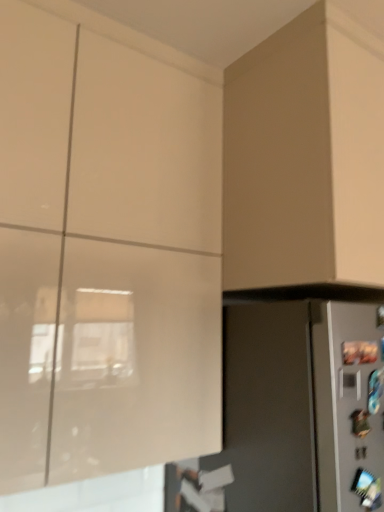
You are a GUI agent. You are given a task and a screenshot of the screen. Output one action in this format:
    pyautogui.click(x=<x>, y=<y>)
    Task: Click on the matte white cabinet at upper left, which is counted as the 2th cabinetry, starting from the right
    This screenshot has height=512, width=384.
    Given the screenshot: What is the action you would take?
    pyautogui.click(x=105, y=248)

Find the location of `matte gray refrigerator at lower right`. matte gray refrigerator at lower right is located at coordinates (296, 410).

You are a GUI agent. You are given a task and a screenshot of the screen. Output one action in this format:
    pyautogui.click(x=<x>, y=<y>)
    Task: Click on the matte beige cabinet at upper right, arranged as the second cabinetry when viewed from the left
    This screenshot has height=512, width=384.
    Given the screenshot: What is the action you would take?
    pyautogui.click(x=305, y=156)

The width and height of the screenshot is (384, 512). Identify the location of matte white cabinet at upper left, which is counted as the 2th cabinetry, starting from the right. (105, 248).

Is matte white cabinet at upper left, which is counted as the 2th cabinetry, starting from the right, closer to camera compared to matte beige cabinet at upper right, arranged as the second cabinetry when viewed from the left?

Yes, it is.

The image size is (384, 512). Identify the location of cabinetry that appears on the left of matte beige cabinet at upper right, acting as the 1th cabinetry starting from the right. (105, 248).

Would you say matte white cabinet at upper left, arranged as the 1th cabinetry when viewed from the left, is inside or outside matte beige cabinet at upper right, arranged as the second cabinetry when viewed from the left?

matte white cabinet at upper left, arranged as the 1th cabinetry when viewed from the left, lies outside matte beige cabinet at upper right, arranged as the second cabinetry when viewed from the left.

Is there a large distance between matte white cabinet at upper left, which is counted as the 2th cabinetry, starting from the right, and matte beige cabinet at upper right, acting as the 1th cabinetry starting from the right?

No, matte white cabinet at upper left, which is counted as the 2th cabinetry, starting from the right, is not far from matte beige cabinet at upper right, acting as the 1th cabinetry starting from the right.

Measure the distance between matte gray refrigerator at lower right and matte beige cabinet at upper right, acting as the 1th cabinetry starting from the right.

matte gray refrigerator at lower right is 13.05 inches from matte beige cabinet at upper right, acting as the 1th cabinetry starting from the right.

Considering the points (362, 499) and (327, 267), which point is behind, point (362, 499) or point (327, 267)?

Positioned behind is point (327, 267).

Would you consider matte gray refrigerator at lower right to be distant from matte beige cabinet at upper right, arranged as the second cabinetry when viewed from the left?

No, there isn't a large distance between matte gray refrigerator at lower right and matte beige cabinet at upper right, arranged as the second cabinetry when viewed from the left.

What's the angular difference between matte gray refrigerator at lower right and matte beige cabinet at upper right, acting as the 1th cabinetry starting from the right,'s facing directions?

They differ by 3.64e-05 degrees in their facing directions.

Considering the relative positions of matte beige cabinet at upper right, acting as the 1th cabinetry starting from the right, and matte gray refrigerator at lower right in the image provided, is matte beige cabinet at upper right, acting as the 1th cabinetry starting from the right, to the left or to the right of matte gray refrigerator at lower right?

From the image, it's evident that matte beige cabinet at upper right, acting as the 1th cabinetry starting from the right, is to the right of matte gray refrigerator at lower right.

Between matte beige cabinet at upper right, acting as the 1th cabinetry starting from the right, and matte gray refrigerator at lower right, which one has smaller size?

With smaller size is matte beige cabinet at upper right, acting as the 1th cabinetry starting from the right.

From the image's perspective, which is above, matte beige cabinet at upper right, acting as the 1th cabinetry starting from the right, or matte gray refrigerator at lower right?

matte beige cabinet at upper right, acting as the 1th cabinetry starting from the right, is shown above in the image.

From the image's perspective, would you say matte beige cabinet at upper right, arranged as the second cabinetry when viewed from the left, is shown under matte white cabinet at upper left, arranged as the 1th cabinetry when viewed from the left?

No, from the image's perspective, matte beige cabinet at upper right, arranged as the second cabinetry when viewed from the left, is not below matte white cabinet at upper left, arranged as the 1th cabinetry when viewed from the left.

Considering the relative sizes of matte beige cabinet at upper right, arranged as the second cabinetry when viewed from the left, and matte white cabinet at upper left, which is counted as the 2th cabinetry, starting from the right, in the image provided, is matte beige cabinet at upper right, arranged as the second cabinetry when viewed from the left, shorter than matte white cabinet at upper left, which is counted as the 2th cabinetry, starting from the right,?

Indeed, matte beige cabinet at upper right, arranged as the second cabinetry when viewed from the left, has a lesser height compared to matte white cabinet at upper left, which is counted as the 2th cabinetry, starting from the right.

Is matte beige cabinet at upper right, arranged as the second cabinetry when viewed from the left, far away from matte white cabinet at upper left, arranged as the 1th cabinetry when viewed from the left?

Actually, matte beige cabinet at upper right, arranged as the second cabinetry when viewed from the left, and matte white cabinet at upper left, arranged as the 1th cabinetry when viewed from the left, are a little close together.

Considering the relative sizes of matte white cabinet at upper left, arranged as the 1th cabinetry when viewed from the left, and matte gray refrigerator at lower right in the image provided, is matte white cabinet at upper left, arranged as the 1th cabinetry when viewed from the left, shorter than matte gray refrigerator at lower right?

No, matte white cabinet at upper left, arranged as the 1th cabinetry when viewed from the left, is not shorter than matte gray refrigerator at lower right.

Based on the photo, how distant is matte white cabinet at upper left, arranged as the 1th cabinetry when viewed from the left, from matte gray refrigerator at lower right?

matte white cabinet at upper left, arranged as the 1th cabinetry when viewed from the left, is 13.02 inches away from matte gray refrigerator at lower right.

Are matte white cabinet at upper left, which is counted as the 2th cabinetry, starting from the right, and matte gray refrigerator at lower right far apart?

matte white cabinet at upper left, which is counted as the 2th cabinetry, starting from the right, is actually quite close to matte gray refrigerator at lower right.

Looking at this image, from a real-world perspective, which is physically below, matte white cabinet at upper left, which is counted as the 2th cabinetry, starting from the right, or matte gray refrigerator at lower right?

In real-world perspective, matte gray refrigerator at lower right is lower.

Considering the relative positions of matte gray refrigerator at lower right and matte white cabinet at upper left, which is counted as the 2th cabinetry, starting from the right, in the image provided, is matte gray refrigerator at lower right in front of matte white cabinet at upper left, which is counted as the 2th cabinetry, starting from the right,?

No, matte gray refrigerator at lower right is further to the viewer.

Is matte gray refrigerator at lower right looking in the opposite direction of matte white cabinet at upper left, arranged as the 1th cabinetry when viewed from the left?

No, matte gray refrigerator at lower right's orientation is not away from matte white cabinet at upper left, arranged as the 1th cabinetry when viewed from the left.

Is matte gray refrigerator at lower right far away from matte white cabinet at upper left, arranged as the 1th cabinetry when viewed from the left?

matte gray refrigerator at lower right is actually quite close to matte white cabinet at upper left, arranged as the 1th cabinetry when viewed from the left.

From a real-world perspective, who is located lower, matte gray refrigerator at lower right or matte white cabinet at upper left, which is counted as the 2th cabinetry, starting from the right?

matte gray refrigerator at lower right, from a real-world perspective.

At what (x,y) coordinates should I click in order to perform the action: click on cabinetry above the matte white cabinet at upper left, arranged as the 1th cabinetry when viewed from the left (from a real-world perspective). Please return your answer as a coordinate pair (x, y). Looking at the image, I should click on [x=305, y=156].

Locate an element on the screen. The width and height of the screenshot is (384, 512). cabinetry located behind the matte gray refrigerator at lower right is located at coordinates (305, 156).

Which object lies further to the anchor point matte gray refrigerator at lower right, matte beige cabinet at upper right, acting as the 1th cabinetry starting from the right, or matte white cabinet at upper left, which is counted as the 2th cabinetry, starting from the right?

matte beige cabinet at upper right, acting as the 1th cabinetry starting from the right, lies further to matte gray refrigerator at lower right than the other object.

From the image, which object appears to be farther from matte beige cabinet at upper right, acting as the 1th cabinetry starting from the right, matte white cabinet at upper left, which is counted as the 2th cabinetry, starting from the right, or matte gray refrigerator at lower right?

matte white cabinet at upper left, which is counted as the 2th cabinetry, starting from the right, is positioned further to the anchor matte beige cabinet at upper right, acting as the 1th cabinetry starting from the right.

Estimate the real-world distances between objects in this image. Which object is further from matte white cabinet at upper left, which is counted as the 2th cabinetry, starting from the right, matte beige cabinet at upper right, acting as the 1th cabinetry starting from the right, or matte gray refrigerator at lower right?

matte beige cabinet at upper right, acting as the 1th cabinetry starting from the right, lies further to matte white cabinet at upper left, which is counted as the 2th cabinetry, starting from the right, than the other object.

When comparing their distances from matte beige cabinet at upper right, acting as the 1th cabinetry starting from the right, does matte gray refrigerator at lower right or matte white cabinet at upper left, which is counted as the 2th cabinetry, starting from the right, seem further?

Based on the image, matte white cabinet at upper left, which is counted as the 2th cabinetry, starting from the right, appears to be further to matte beige cabinet at upper right, acting as the 1th cabinetry starting from the right.

When comparing their distances from matte gray refrigerator at lower right, does matte white cabinet at upper left, which is counted as the 2th cabinetry, starting from the right, or matte beige cabinet at upper right, acting as the 1th cabinetry starting from the right, seem further?

matte beige cabinet at upper right, acting as the 1th cabinetry starting from the right, lies further to matte gray refrigerator at lower right than the other object.

When comparing their distances from matte white cabinet at upper left, arranged as the 1th cabinetry when viewed from the left, does matte gray refrigerator at lower right or matte beige cabinet at upper right, acting as the 1th cabinetry starting from the right, seem further?

Based on the image, matte beige cabinet at upper right, acting as the 1th cabinetry starting from the right, appears to be further to matte white cabinet at upper left, arranged as the 1th cabinetry when viewed from the left.

This screenshot has width=384, height=512. I want to click on cabinetry between matte beige cabinet at upper right, arranged as the second cabinetry when viewed from the left, and matte gray refrigerator at lower right, in the vertical direction, so click(x=105, y=248).